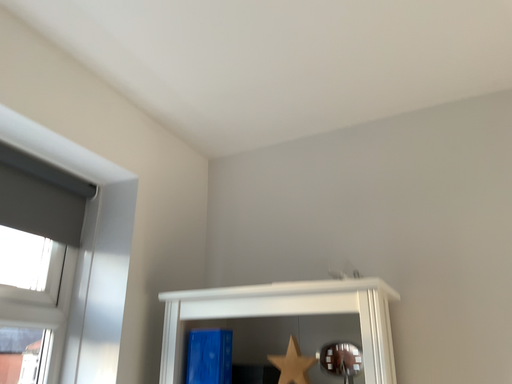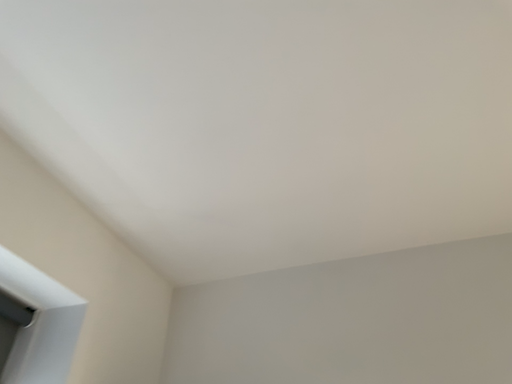
Question: Which way did the camera rotate in the video?

Choices:
 (A) rotated downward
 (B) rotated upward

Answer: (B)